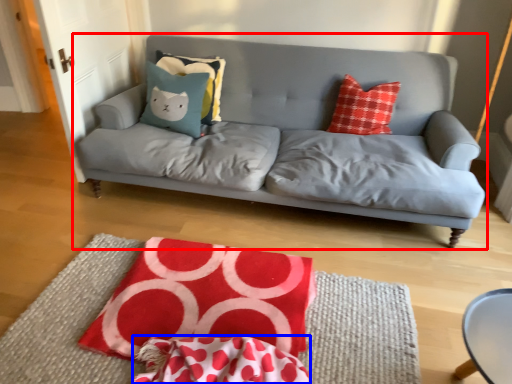
Question: Which object is further to the camera taking this photo, studio couch (highlighted by a red box) or material (highlighted by a blue box)?

Choices:
 (A) studio couch
 (B) material

Answer: (A)